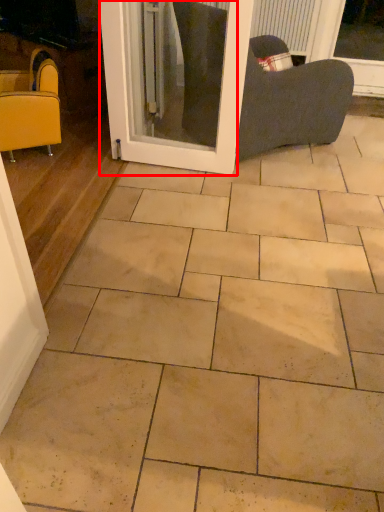
Question: From the image's perspective, where is screen door (annotated by the red box) located relative to chair?

Choices:
 (A) above
 (B) below

Answer: (A)